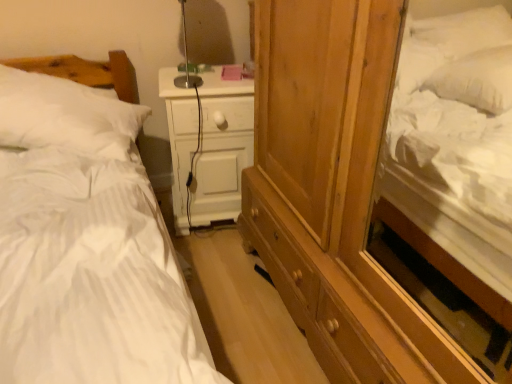
Question: From the image's perspective, is white soft pillow at left beneath white matte nightstand at center?

Choices:
 (A) no
 (B) yes

Answer: (A)

Question: Does white soft pillow at left contain white matte nightstand at center?

Choices:
 (A) no
 (B) yes

Answer: (A)

Question: Is white soft pillow at left bigger than white matte nightstand at center?

Choices:
 (A) yes
 (B) no

Answer: (A)

Question: From a real-world perspective, is white soft pillow at left physically below white matte nightstand at center?

Choices:
 (A) no
 (B) yes

Answer: (A)

Question: Is the depth of white soft pillow at left greater than that of white matte nightstand at center?

Choices:
 (A) no
 (B) yes

Answer: (A)

Question: From the image's perspective, is white soft pillow at left above or below white striped fabric bed at left?

Choices:
 (A) below
 (B) above

Answer: (B)

Question: Considering the positions of white soft pillow at left and white striped fabric bed at left in the image, is white soft pillow at left bigger or smaller than white striped fabric bed at left?

Choices:
 (A) big
 (B) small

Answer: (B)

Question: Is white soft pillow at left taller or shorter than white striped fabric bed at left?

Choices:
 (A) short
 (B) tall

Answer: (A)

Question: Is white soft pillow at left wider or thinner than white striped fabric bed at left?

Choices:
 (A) thin
 (B) wide

Answer: (A)

Question: Looking at their shapes, would you say white matte nightstand at center is wider or thinner than white striped fabric bed at left?

Choices:
 (A) thin
 (B) wide

Answer: (A)

Question: From the image's perspective, is white matte nightstand at center above or below white striped fabric bed at left?

Choices:
 (A) below
 (B) above

Answer: (B)

Question: Choose the correct answer: Is white matte nightstand at center inside white striped fabric bed at left or outside it?

Choices:
 (A) inside
 (B) outside

Answer: (B)

Question: Does point (175, 134) appear closer or farther from the camera than point (137, 223)?

Choices:
 (A) farther
 (B) closer

Answer: (A)

Question: Considering the positions of white striped fabric bed at left and white soft pillow at left in the image, is white striped fabric bed at left bigger or smaller than white soft pillow at left?

Choices:
 (A) small
 (B) big

Answer: (B)

Question: From a real-world perspective, is white striped fabric bed at left physically located above or below white soft pillow at left?

Choices:
 (A) below
 (B) above

Answer: (A)